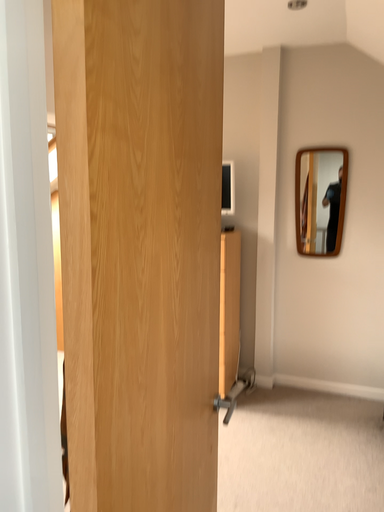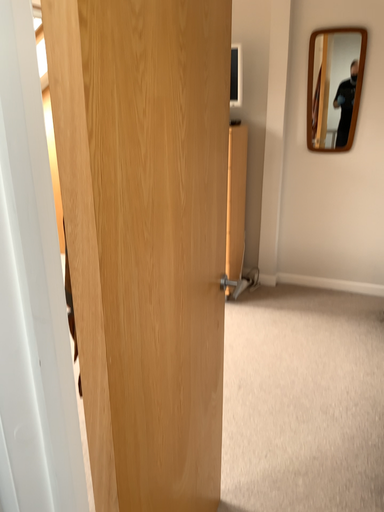
Question: Which way did the camera rotate in the video?

Choices:
 (A) rotated upward
 (B) rotated downward

Answer: (B)